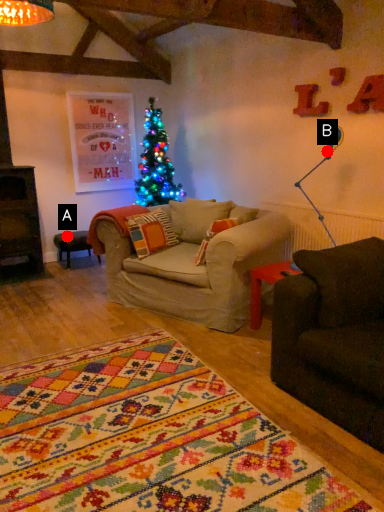
Question: Two points are circled on the image, labeled by A and B beside each circle. Which point is further to the camera?

Choices:
 (A) A is further
 (B) B is further

Answer: (A)